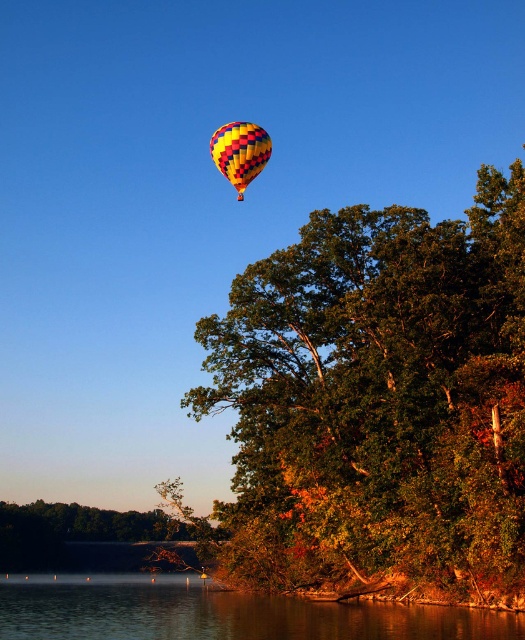
Question: Is green leafy tree at upper center below yellow and red checkered fabric balloon at upper center?

Choices:
 (A) yes
 (B) no

Answer: (A)

Question: Which object appears closest to the camera in this image?

Choices:
 (A) green leafy tree at lower center
 (B) smooth water at lower center
 (C) yellow and red checkered fabric balloon at upper center

Answer: (B)

Question: Is smooth water at lower center bigger than green leafy tree at lower center?

Choices:
 (A) yes
 (B) no

Answer: (A)

Question: Can you confirm if green leafy tree at upper center is wider than smooth water at lower center?

Choices:
 (A) no
 (B) yes

Answer: (A)

Question: Which point is farther to the camera?

Choices:
 (A) green leafy tree at upper center
 (B) smooth water at lower center
 (C) green leafy tree at lower center
 (D) yellow and red checkered fabric balloon at upper center

Answer: (C)

Question: Which of the following is the closest to the observer?

Choices:
 (A) (257, 144)
 (B) (470, 532)

Answer: (B)